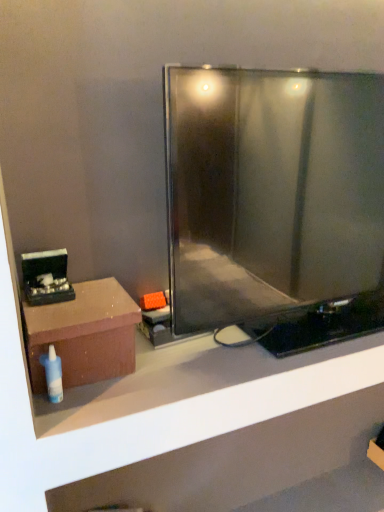
At what (x,y) coordinates should I click in order to perform the action: click on unoccupied region to the right of matte brown box at left. Please return your answer as a coordinate pair (x, y). The image size is (384, 512). Looking at the image, I should click on (174, 368).